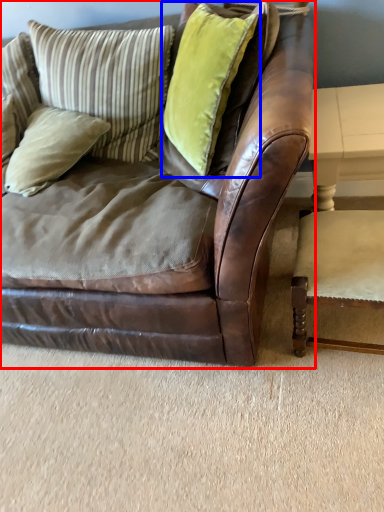
Question: Which object appears farthest to the camera in this image, studio couch (highlighted by a red box) or pillow (highlighted by a blue box)?

Choices:
 (A) studio couch
 (B) pillow

Answer: (B)